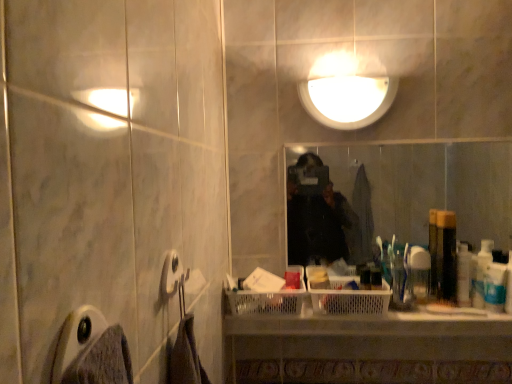
Question: Should I look upward or downward to see white plastic bottle at right, which is the first toiletry in right-to-left order?

Choices:
 (A) up
 (B) down

Answer: (B)

Question: From the image's perspective, would you say translucent plastic bottle at right, which appears as the third toiletry when viewed from the right, is shown under white plastic bottle at right, which is the first toiletry in right-to-left order?

Choices:
 (A) yes
 (B) no

Answer: (B)

Question: Is white plastic bottle at right, which is the first toiletry in right-to-left order, a part of translucent plastic bottle at right, which appears as the third toiletry when viewed from the right?

Choices:
 (A) yes
 (B) no

Answer: (B)

Question: Is the depth of translucent plastic bottle at right, which appears as the third toiletry when viewed from the right, greater than that of white plastic bottle at right, which is the first toiletry in right-to-left order?

Choices:
 (A) yes
 (B) no

Answer: (A)

Question: From a real-world perspective, does translucent plastic bottle at right, which appears as the third toiletry when viewed from the right, sit lower than white plastic bottle at right, which is the first toiletry in right-to-left order?

Choices:
 (A) no
 (B) yes

Answer: (A)

Question: Does translucent plastic bottle at right, arranged as the third toiletry when viewed from the left, turn towards white plastic bottle at right, which is the first toiletry in right-to-left order?

Choices:
 (A) yes
 (B) no

Answer: (B)

Question: Is white plastic bottle at right, which is the first toiletry in right-to-left order, at the back of translucent plastic bottle at right, arranged as the third toiletry when viewed from the left?

Choices:
 (A) yes
 (B) no

Answer: (B)

Question: From the image's perspective, would you say white plastic bottle at right, the fifth toiletry positioned from the left, is positioned over white plastic toothbrush at right, which ranks as the 2th toiletry in right-to-left order?

Choices:
 (A) no
 (B) yes

Answer: (A)

Question: Does white plastic bottle at right, which is the first toiletry in right-to-left order, have a larger size compared to white plastic toothbrush at right, which is counted as the 4th toiletry, starting from the left?

Choices:
 (A) no
 (B) yes

Answer: (A)

Question: From a real-world perspective, is white plastic bottle at right, the fifth toiletry positioned from the left, positioned over white plastic toothbrush at right, which ranks as the 2th toiletry in right-to-left order, based on gravity?

Choices:
 (A) yes
 (B) no

Answer: (B)

Question: Is white plastic bottle at right, the fifth toiletry positioned from the left, outside of white plastic toothbrush at right, which ranks as the 2th toiletry in right-to-left order?

Choices:
 (A) no
 (B) yes

Answer: (B)

Question: From the image's perspective, is white plastic bottle at right, which is the first toiletry in right-to-left order, below white plastic toothbrush at right, which ranks as the 2th toiletry in right-to-left order?

Choices:
 (A) yes
 (B) no

Answer: (A)

Question: Does white plastic bottle at right, which is the first toiletry in right-to-left order, have a lesser width compared to white plastic toothbrush at right, which is counted as the 4th toiletry, starting from the left?

Choices:
 (A) no
 (B) yes

Answer: (A)

Question: Is translucent plastic bottle at right, the 2th toiletry from the left, positioned beyond the bounds of gray fabric towel bar at lower left?

Choices:
 (A) no
 (B) yes

Answer: (B)